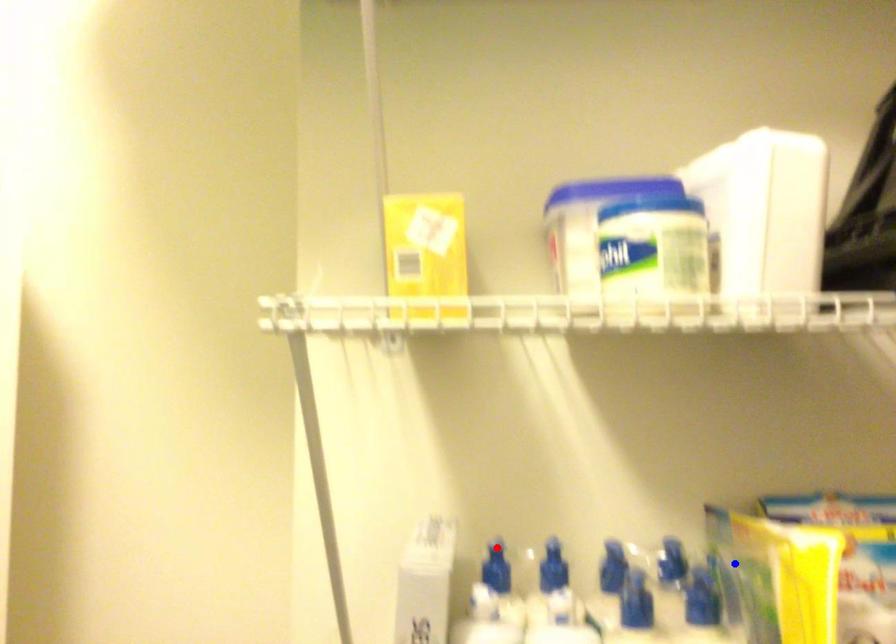
Question: Which of the two points in the image is closer to the camera?

Choices:
 (A) Blue point is closer.
 (B) Red point is closer.

Answer: (A)